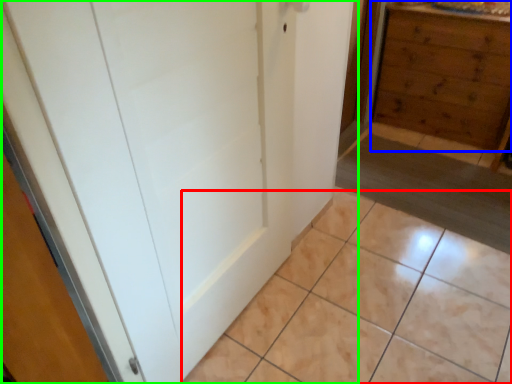
Question: Considering the real-world distances, which object is farthest from ceramic tile (highlighted by a red box)? chest of drawers (highlighted by a blue box) or door (highlighted by a green box)?

Choices:
 (A) chest of drawers
 (B) door

Answer: (A)